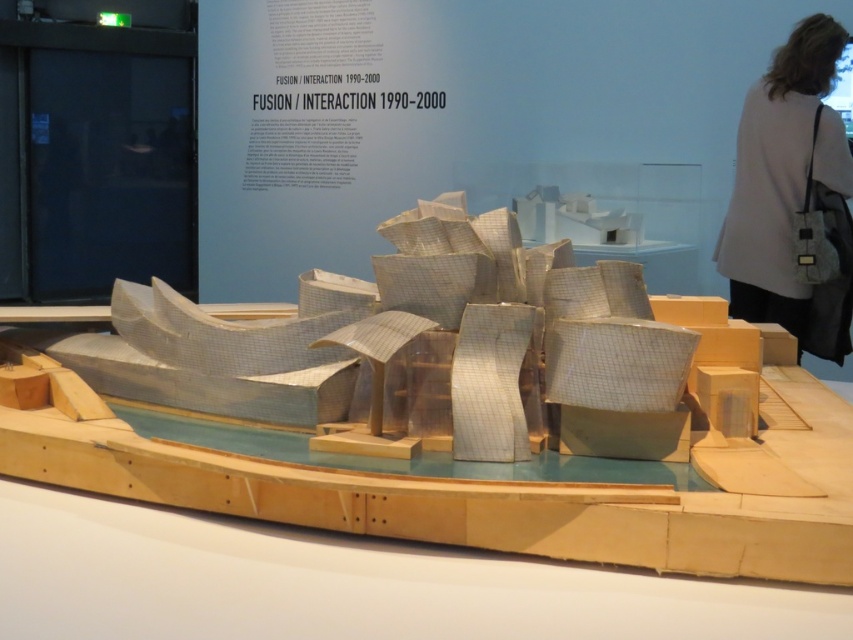
You are an architect visiting the museum and notice the metallic grid boat at center and the white fabric bag at upper right. Based on their heights, which object would require a taller storage container if you wanted to pack both separately?

The white fabric bag at upper right requires a taller storage container because it is taller than the metallic grid boat at center.